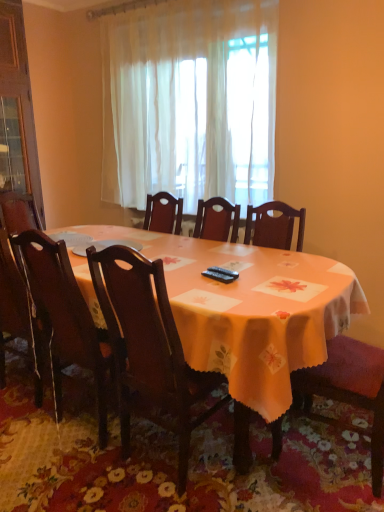
Question: Is white sheer curtain at center shorter than wooden chair at right, which is counted as the third chair, starting from the left?

Choices:
 (A) no
 (B) yes

Answer: (A)

Question: Is white sheer curtain at center far away from wooden chair at right, which is counted as the third chair, starting from the left?

Choices:
 (A) yes
 (B) no

Answer: (A)

Question: Does white sheer curtain at center come behind wooden chair at right, which is counted as the third chair, starting from the left?

Choices:
 (A) no
 (B) yes

Answer: (B)

Question: Is white sheer curtain at center turned away from wooden chair at right, which is counted as the third chair, starting from the left?

Choices:
 (A) no
 (B) yes

Answer: (A)

Question: Is white sheer curtain at center thinner than wooden chair at right, the first chair when ordered from right to left?

Choices:
 (A) yes
 (B) no

Answer: (A)

Question: Is white sheer curtain at center facing towards wooden chair at right, which is counted as the third chair, starting from the left?

Choices:
 (A) yes
 (B) no

Answer: (B)

Question: Considering the relative sizes of wooden chair at right, which is counted as the third chair, starting from the left, and white sheer curtain at center in the image provided, is wooden chair at right, which is counted as the third chair, starting from the left, thinner than white sheer curtain at center?

Choices:
 (A) no
 (B) yes

Answer: (A)

Question: Is wooden chair at right, which is counted as the third chair, starting from the left, positioned in front of white sheer curtain at center?

Choices:
 (A) no
 (B) yes

Answer: (B)

Question: Is wooden chair at right, the first chair when ordered from right to left, not close to white sheer curtain at center?

Choices:
 (A) yes
 (B) no

Answer: (A)

Question: Considering the relative sizes of wooden chair at right, which is counted as the third chair, starting from the left, and white sheer curtain at center in the image provided, is wooden chair at right, which is counted as the third chair, starting from the left, shorter than white sheer curtain at center?

Choices:
 (A) yes
 (B) no

Answer: (A)

Question: Would you say wooden chair at right, the first chair when ordered from right to left, contains white sheer curtain at center?

Choices:
 (A) yes
 (B) no

Answer: (B)

Question: Considering the relative sizes of wooden chair at right, which is counted as the third chair, starting from the left, and white sheer curtain at center in the image provided, is wooden chair at right, which is counted as the third chair, starting from the left, wider than white sheer curtain at center?

Choices:
 (A) yes
 (B) no

Answer: (A)

Question: Is the depth of wooden chair at right, the first chair when ordered from right to left, less than that of orange fabric table at center?

Choices:
 (A) yes
 (B) no

Answer: (B)